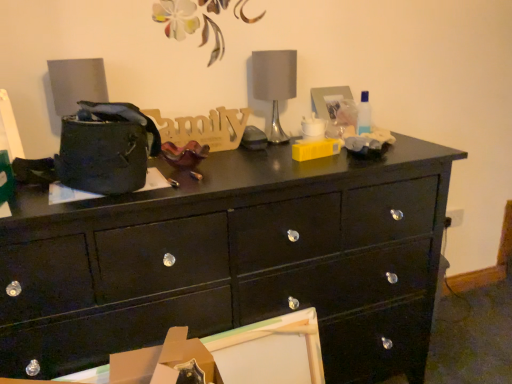
Locate an element on the screen. This screenshot has height=384, width=512. satin silver table lamp at center is located at coordinates (274, 84).

This screenshot has width=512, height=384. What do you see at coordinates (163, 361) in the screenshot? I see `cardboard box at lower center` at bounding box center [163, 361].

The height and width of the screenshot is (384, 512). What are the coordinates of `black glossy chest of drawers at center` in the screenshot? It's located at (233, 261).

What are the coordinates of `satin silver table lamp at center` in the screenshot? It's located at (274, 84).

Considering the sizes of objects cardboard box at lower center and satin silver table lamp at center in the image provided, who is smaller, cardboard box at lower center or satin silver table lamp at center?

cardboard box at lower center.

Which is behind, cardboard box at lower center or satin silver table lamp at center?

satin silver table lamp at center is behind.

Can you tell me how much cardboard box at lower center and satin silver table lamp at center differ in facing direction?

There is a 6.32-degree angle between the facing directions of cardboard box at lower center and satin silver table lamp at center.

Is satin silver table lamp at center to the left or to the right of black glossy chest of drawers at center in the image?

satin silver table lamp at center is positioned on black glossy chest of drawers at center's right side.

Is satin silver table lamp at center facing away from black glossy chest of drawers at center?

No, black glossy chest of drawers at center is not at the back of satin silver table lamp at center.

From the image's perspective, does satin silver table lamp at center appear lower than black glossy chest of drawers at center?

No.

Considering the positions of objects glossy black drawer at lower left and satin silver table lamp at center in the image provided, who is behind, glossy black drawer at lower left or satin silver table lamp at center?

Positioned behind is satin silver table lamp at center.

Is glossy black drawer at lower left inside or outside of satin silver table lamp at center?

glossy black drawer at lower left cannot be found inside satin silver table lamp at center.

Are glossy black drawer at lower left and satin silver table lamp at center far apart?

No, there isn't a large distance between glossy black drawer at lower left and satin silver table lamp at center.

From a real-world perspective, is glossy black drawer at lower left located beneath satin silver table lamp at center?

Indeed, from a real-world perspective, glossy black drawer at lower left is positioned beneath satin silver table lamp at center.

Identify the location of cardboard box located below the black glossy chest of drawers at center (from the image's perspective). Image resolution: width=512 pixels, height=384 pixels. (163, 361).

How different are the orientations of cardboard box at lower center and black glossy chest of drawers at center in degrees?

The facing directions of cardboard box at lower center and black glossy chest of drawers at center are 4.46 degrees apart.

Between cardboard box at lower center and black glossy chest of drawers at center, which one appears on the right side from the viewer's perspective?

black glossy chest of drawers at center.

Is cardboard box at lower center not inside black glossy chest of drawers at center?

Yes.

From the picture: From a real-world perspective, which object rests below the other?

In real-world perspective, black glossy chest of drawers at center is lower.

How many degrees apart are the facing directions of glossy black drawer at lower left and black glossy chest of drawers at center?

They differ by 1.29 degrees in their facing directions.

Is glossy black drawer at lower left in front of black glossy chest of drawers at center?

That is True.

Considering the relative sizes of glossy black drawer at lower left and black glossy chest of drawers at center in the image provided, is glossy black drawer at lower left wider than black glossy chest of drawers at center?

No, glossy black drawer at lower left is not wider than black glossy chest of drawers at center.

Is point (341, 231) farther from camera compared to point (165, 350)?

Yes, it is.

From the image's perspective, is black glossy chest of drawers at center beneath cardboard box at lower center?

No.

You are a GUI agent. You are given a task and a screenshot of the screen. Output one action in this format:
    pyautogui.click(x=<x>, y=<y>)
    Task: Click on the chest of drawers directly beneath the cardboard box at lower center (from a real-world perspective)
    The image size is (512, 384).
    Given the screenshot: What is the action you would take?
    pyautogui.click(x=233, y=261)

Is there a large distance between black glossy chest of drawers at center and cardboard box at lower center?

No, black glossy chest of drawers at center is in close proximity to cardboard box at lower center.

Considering the relative positions of satin silver table lamp at center and cardboard box at lower center in the image provided, is satin silver table lamp at center to the right of cardboard box at lower center from the viewer's perspective?

Yes.

Does point (270, 58) appear closer or farther from the camera than point (212, 376)?

Point (270, 58) appears to be farther away from the viewer than point (212, 376).

In the scene shown: How much distance is there between satin silver table lamp at center and cardboard box at lower center?

satin silver table lamp at center and cardboard box at lower center are 35.31 inches apart from each other.

Is satin silver table lamp at center in front of or behind cardboard box at lower center in the image?

Clearly, satin silver table lamp at center is behind cardboard box at lower center.

Locate an element on the screen. cardboard box in front of the satin silver table lamp at center is located at coordinates (163, 361).

Find the location of a particular element. the chest of drawers that appears below the satin silver table lamp at center (from a real-world perspective) is located at coordinates (233, 261).

Estimate the real-world distances between objects in this image. Which object is further from satin silver table lamp at center, black glossy chest of drawers at center or glossy black drawer at lower left?

Among the two, glossy black drawer at lower left is located further to satin silver table lamp at center.

Which object lies further to the anchor point cardboard box at lower center, glossy black drawer at lower left or satin silver table lamp at center?

satin silver table lamp at center is further to cardboard box at lower center.

Considering their positions, is glossy black drawer at lower left positioned closer to satin silver table lamp at center than black glossy chest of drawers at center?

The object closer to satin silver table lamp at center is black glossy chest of drawers at center.

Considering their positions, is cardboard box at lower center positioned closer to satin silver table lamp at center than black glossy chest of drawers at center?

Among the two, black glossy chest of drawers at center is located nearer to satin silver table lamp at center.

Considering their positions, is black glossy chest of drawers at center positioned closer to glossy black drawer at lower left than satin silver table lamp at center?

black glossy chest of drawers at center is positioned closer to the anchor glossy black drawer at lower left.

Looking at the image, which one is located closer to cardboard box at lower center, black glossy chest of drawers at center or satin silver table lamp at center?

Based on the image, black glossy chest of drawers at center appears to be nearer to cardboard box at lower center.

Considering their positions, is satin silver table lamp at center positioned further to cardboard box at lower center than glossy black drawer at lower left?

Based on the image, satin silver table lamp at center appears to be further to cardboard box at lower center.

Estimate the real-world distances between objects in this image. Which object is further from glossy black drawer at lower left, satin silver table lamp at center or cardboard box at lower center?

satin silver table lamp at center is further to glossy black drawer at lower left.

At what (x,y) coordinates should I click in order to perform the action: click on chest of drawers between satin silver table lamp at center and glossy black drawer at lower left in the up-down direction. Please return your answer as a coordinate pair (x, y). The image size is (512, 384). Looking at the image, I should click on (233, 261).

Locate an element on the screen. This screenshot has width=512, height=384. cardboard box between satin silver table lamp at center and glossy black drawer at lower left from top to bottom is located at coordinates (163, 361).

Image resolution: width=512 pixels, height=384 pixels. Find the location of `chest of drawers between satin silver table lamp at center and cardboard box at lower center in the vertical direction`. chest of drawers between satin silver table lamp at center and cardboard box at lower center in the vertical direction is located at coordinates (233, 261).

This screenshot has height=384, width=512. I want to click on cardboard box between glossy black drawer at lower left and black glossy chest of drawers at center from front to back, so click(163, 361).